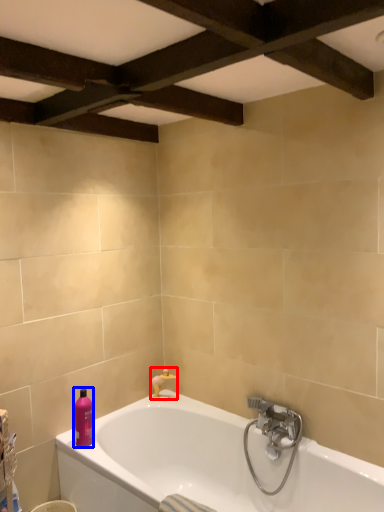
Question: Among these objects, which one is farthest to the camera, faucet (highlighted by a red box) or toiletry (highlighted by a blue box)?

Choices:
 (A) faucet
 (B) toiletry

Answer: (A)